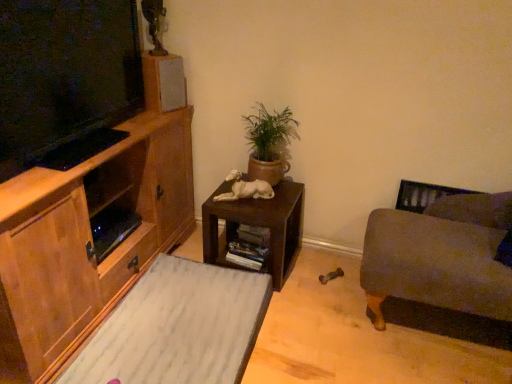
I want to click on velvet gray couch at right, so click(440, 256).

Where is `white marble rug at lower left`? The height and width of the screenshot is (384, 512). white marble rug at lower left is located at coordinates (178, 328).

This screenshot has height=384, width=512. What do you see at coordinates (178, 328) in the screenshot?
I see `white marble rug at lower left` at bounding box center [178, 328].

This screenshot has width=512, height=384. What do you see at coordinates (245, 188) in the screenshot?
I see `white glossy statue at center` at bounding box center [245, 188].

Image resolution: width=512 pixels, height=384 pixels. Describe the element at coordinates (164, 82) in the screenshot. I see `matte gray speaker at upper center` at that location.

Measure the distance between point (228,238) and camera.

Point (228,238) is 6.99 feet away from camera.

Locate an element on the screen. This screenshot has height=384, width=512. velvet gray couch at right is located at coordinates (440, 256).

Is matte gray speaker at upper center wider or thinner than white glossy statue at center?

matte gray speaker at upper center is thinner than white glossy statue at center.

Who is shorter, matte gray speaker at upper center or white glossy statue at center?

white glossy statue at center is shorter.

Locate an element on the screen. The height and width of the screenshot is (384, 512). speaker positioned vertically above the white glossy statue at center (from a real-world perspective) is located at coordinates click(164, 82).

Is matte gray speaker at upper center turned away from white glossy statue at center?

No, matte gray speaker at upper center is not facing the opposite direction of white glossy statue at center.

Is velvet gray couch at right not close to green terracotta pot at center?

Actually, velvet gray couch at right and green terracotta pot at center are a little close together.

Is point (437, 210) positioned after point (289, 137)?

No.

From a real-world perspective, which object stands above the other?

green terracotta pot at center, from a real-world perspective.

In the image, is velvet gray couch at right positioned in front of or behind green terracotta pot at center?

velvet gray couch at right is positioned closer to the viewer than green terracotta pot at center.

From the image's perspective, is velvet gray couch at right on top of matte gray speaker at upper center?

Incorrect, from the image's perspective, velvet gray couch at right is lower than matte gray speaker at upper center.

Could you tell me if velvet gray couch at right is turned towards matte gray speaker at upper center?

No, velvet gray couch at right is not oriented towards matte gray speaker at upper center.

Considering the sizes of objects velvet gray couch at right and matte gray speaker at upper center in the image provided, who is thinner, velvet gray couch at right or matte gray speaker at upper center?

matte gray speaker at upper center is thinner.

Is matte gray speaker at upper center a part of velvet gray couch at right?

No, matte gray speaker at upper center is located outside of velvet gray couch at right.

In the scene shown: Is matte gray speaker at upper center situated inside velvet gray couch at right or outside?

matte gray speaker at upper center is not inside velvet gray couch at right, it's outside.

Between matte gray speaker at upper center and velvet gray couch at right, which one is positioned behind?

matte gray speaker at upper center is behind.

Are matte gray speaker at upper center and velvet gray couch at right located far from each other?

matte gray speaker at upper center is far away from velvet gray couch at right.

Based on the photo, is dark brown wooden table at center aimed at wooden cabinet at left?

No, dark brown wooden table at center is not aimed at wooden cabinet at left.

Considering the sizes of objects dark brown wooden table at center and wooden cabinet at left in the image provided, who is shorter, dark brown wooden table at center or wooden cabinet at left?

Standing shorter between the two is dark brown wooden table at center.

Is point (290, 254) positioned behind point (34, 199)?

Yes, it is.

Is white marble rug at lower left behind velvet gray couch at right?

No, white marble rug at lower left is closer to the camera.

Considering the sizes of objects white marble rug at lower left and velvet gray couch at right in the image provided, who is taller, white marble rug at lower left or velvet gray couch at right?

Standing taller between the two is velvet gray couch at right.

Is white marble rug at lower left aimed at velvet gray couch at right?

No.

From the image's perspective, relative to velvet gray couch at right, is white marble rug at lower left above or below?

white marble rug at lower left is below velvet gray couch at right.

Considering the sizes of white glossy statue at center and green terracotta pot at center in the image, is white glossy statue at center wider or thinner than green terracotta pot at center?

In the image, white glossy statue at center appears to be wider than green terracotta pot at center.

From a real-world perspective, is white glossy statue at center on green terracotta pot at center?

No, from a real-world perspective, white glossy statue at center is not over green terracotta pot at center

Is white glossy statue at center positioned before green terracotta pot at center?

No, it is behind green terracotta pot at center.

In the scene shown: Does white glossy statue at center turn towards green terracotta pot at center?

No.

Identify the location of speaker that appears above the white glossy statue at center (from a real-world perspective). This screenshot has width=512, height=384. (164, 82).

Where is `houseplant on the left of velvet gray couch at right`? houseplant on the left of velvet gray couch at right is located at coordinates (269, 143).

Which object lies further to the anchor point green terracotta pot at center, white marble rug at lower left or dark brown wooden table at center?

white marble rug at lower left is positioned further to the anchor green terracotta pot at center.

Looking at the image, which one is located further to white glossy statue at center, green terracotta pot at center or dark brown wooden table at center?

Based on the image, green terracotta pot at center appears to be further to white glossy statue at center.

Based on their spatial positions, is matte gray speaker at upper center or velvet gray couch at right further from white glossy statue at center?

Based on the image, velvet gray couch at right appears to be further to white glossy statue at center.

From the image, which object appears to be farther from dark brown wooden table at center, white marble rug at lower left or green terracotta pot at center?

Based on the image, white marble rug at lower left appears to be further to dark brown wooden table at center.

From the image, which object appears to be farther from dark brown wooden table at center, matte gray speaker at upper center or green terracotta pot at center?

Among the two, matte gray speaker at upper center is located further to dark brown wooden table at center.

From the image, which object appears to be farther from white marble rug at lower left, white glossy statue at center or matte gray speaker at upper center?

matte gray speaker at upper center lies further to white marble rug at lower left than the other object.

Looking at the image, which one is located further to wooden cabinet at left, matte gray speaker at upper center or white glossy statue at center?

white glossy statue at center.

Looking at the image, which one is located further to white glossy statue at center, velvet gray couch at right or white marble rug at lower left?

The object further to white glossy statue at center is velvet gray couch at right.

Locate an element on the screen. This screenshot has height=384, width=512. animal between wooden cabinet at left and matte gray speaker at upper center in the front-back direction is located at coordinates (245, 188).

The width and height of the screenshot is (512, 384). I want to click on houseplant between matte gray speaker at upper center and dark brown wooden table at center in the vertical direction, so click(269, 143).

You are a GUI agent. You are given a task and a screenshot of the screen. Output one action in this format:
    pyautogui.click(x=<x>, y=<y>)
    Task: Click on the houseplant between wooden cabinet at left and velvet gray couch at right from left to right
    The image size is (512, 384).
    Given the screenshot: What is the action you would take?
    click(269, 143)

This screenshot has width=512, height=384. Find the location of `animal between matte gray speaker at upper center and green terracotta pot at center in the horizontal direction`. animal between matte gray speaker at upper center and green terracotta pot at center in the horizontal direction is located at coordinates (245, 188).